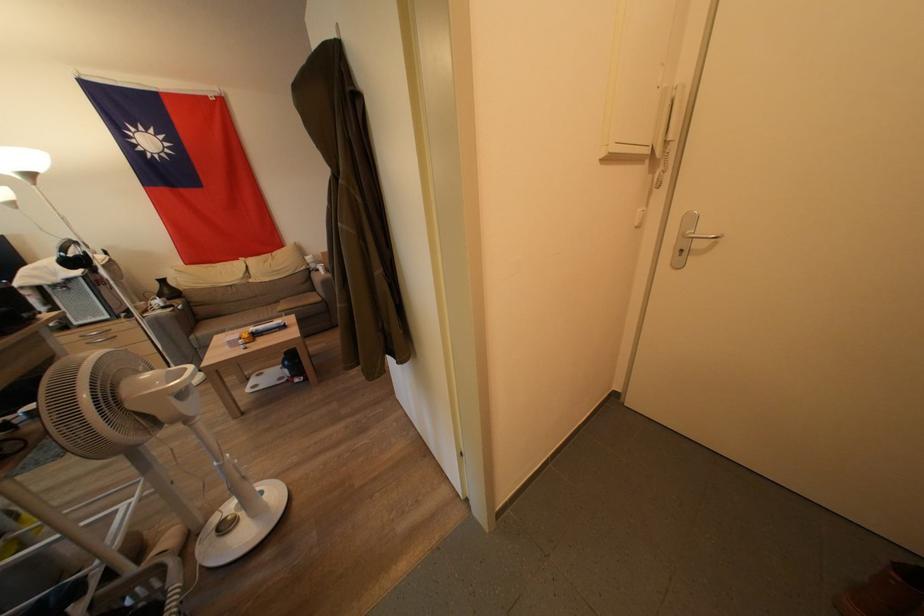
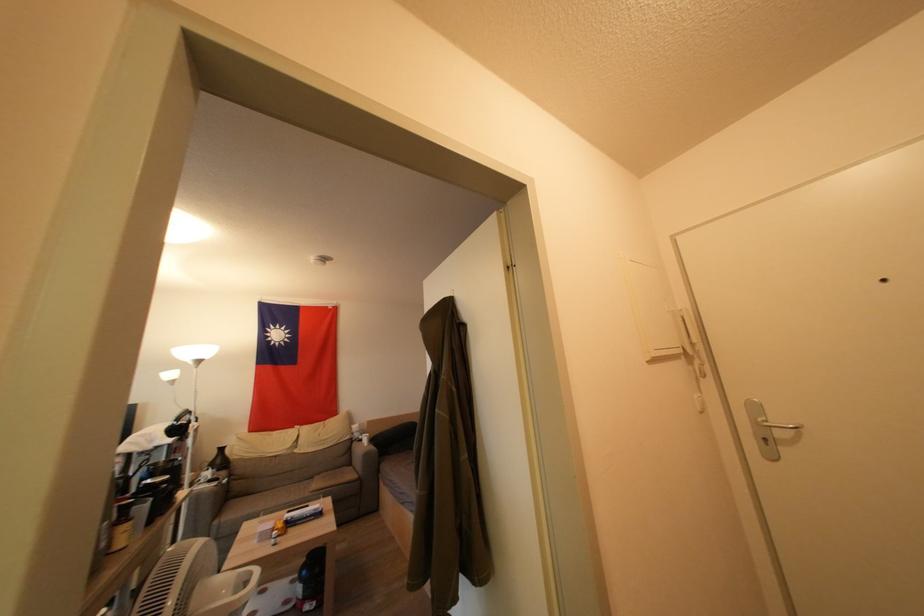
Question: Based on the continuous images, in which direction is the camera rotating? Reply with the corresponding letter.

Choices:
 (A) Left
 (B) Right
 (C) Up
 (D) Down

Answer: (C)